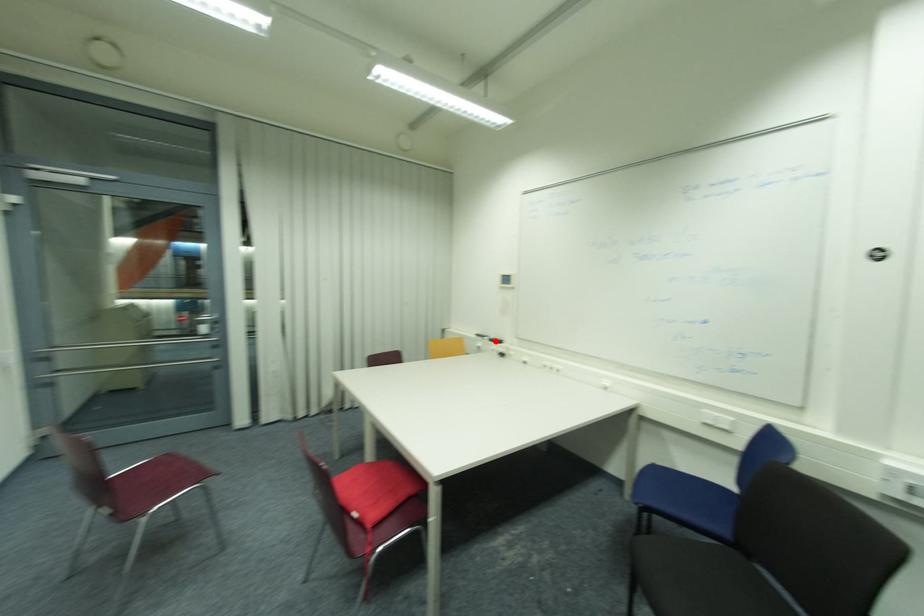
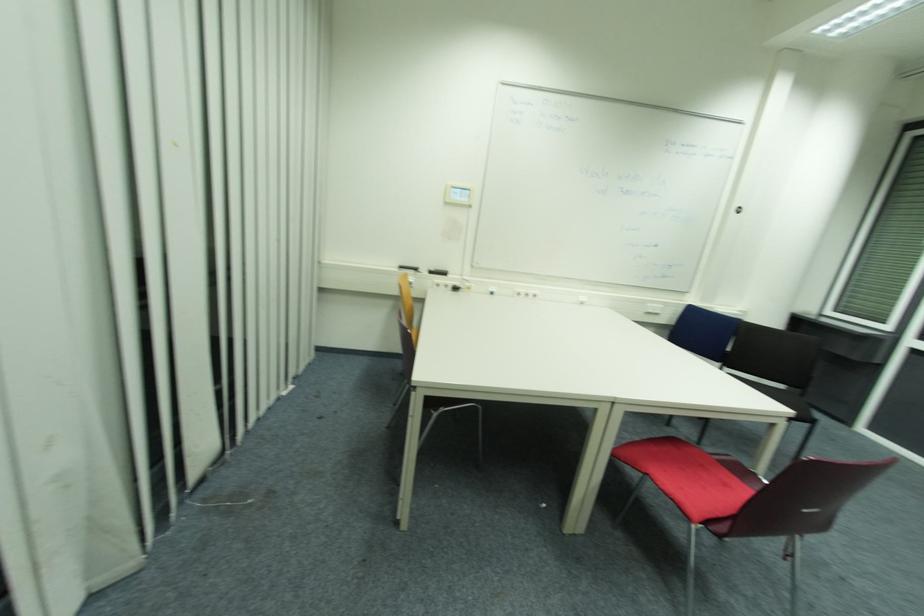
In the second image, find the point that corresponds to the highlighted location in the first image.

(433, 273)